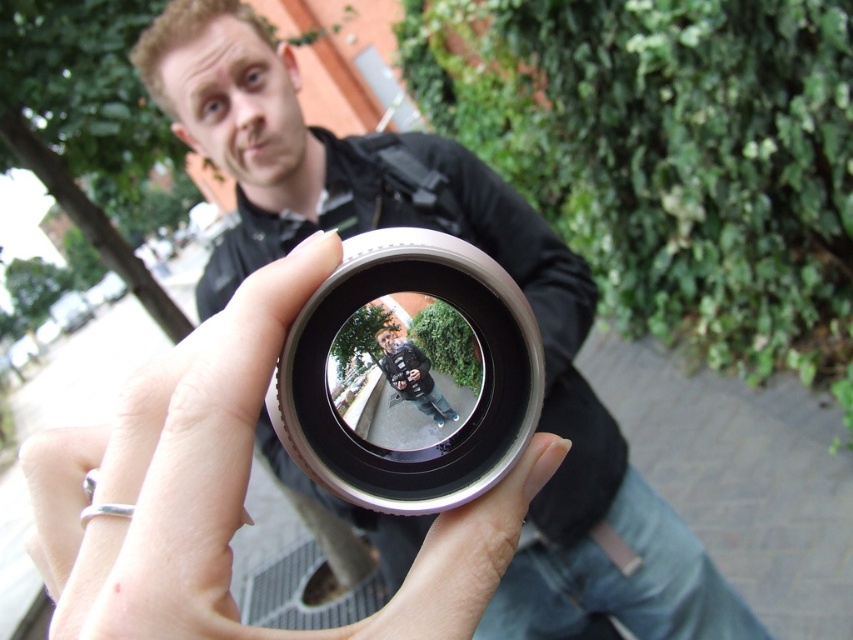
In the scene shown: What is the location of the point with coordinates point (230, 492) in the image?

The point with coordinates point (230, 492) is located on the silver metallic ring at center.

You are a photographer trying to decide which object to focus on first between the silver metallic ring at center and the silver metallic lens at center. Based on their sizes, which one should you choose?

The silver metallic ring at center has a greater height compared to the silver metallic lens at center, so you should focus on the silver metallic ring at center first since it is taller.